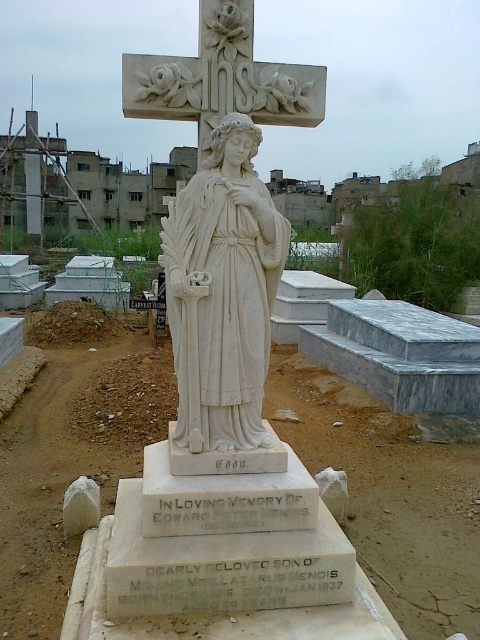
Question: Is white marble statue at center to the left of white marble crucifix at upper center from the viewer's perspective?

Choices:
 (A) no
 (B) yes

Answer: (A)

Question: Is dirtloose soildirt field at center bigger than white marble cross at upper center?

Choices:
 (A) no
 (B) yes

Answer: (A)

Question: Which object appears closest to the camera in this image?

Choices:
 (A) white marble crucifix at upper center
 (B) dirtloose soildirt field at center

Answer: (B)

Question: Does white marble statue at center come in front of white marble cross at upper center?

Choices:
 (A) no
 (B) yes

Answer: (B)

Question: Which point appears farthest from the camera in this image?

Choices:
 (A) (222, 349)
 (B) (172, 60)
 (C) (40, 140)
 (D) (432, 442)

Answer: (C)

Question: Which object is closer to the camera taking this photo?

Choices:
 (A) dirtloose soildirt field at center
 (B) white marble statue at center

Answer: (B)